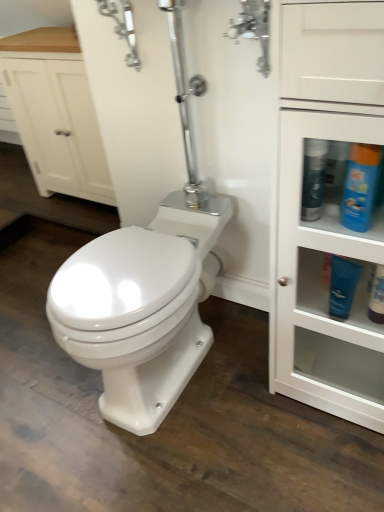
The width and height of the screenshot is (384, 512). What do you see at coordinates (377, 296) in the screenshot?
I see `matte white lotion at lower right, arranged as the second toiletry when viewed from the left` at bounding box center [377, 296].

What do you see at coordinates (55, 113) in the screenshot? The height and width of the screenshot is (512, 384). I see `white wood cabinet at upper left` at bounding box center [55, 113].

The height and width of the screenshot is (512, 384). What are the coordinates of `white wood cabinet at upper left` in the screenshot? It's located at (55, 113).

Where is `blue glossy bottle at upper right, acting as the second cleaning product starting from the right`? blue glossy bottle at upper right, acting as the second cleaning product starting from the right is located at coordinates (313, 178).

Is polished chrome faucet at upper center oriented away from white wood cabinet at upper left?

polished chrome faucet at upper center does not have its back to white wood cabinet at upper left.

Can you confirm if polished chrome faucet at upper center is positioned to the left of white wood cabinet at upper left?

No.

Can you tell me how much white glossy cabinet at right and blue glossy bottle at upper right, placed as the 2th cleaning product when sorted from left to right, differ in facing direction?

They differ by 16.2 degrees in their facing directions.

Looking at this image, is white glossy cabinet at right spatially inside blue glossy bottle at upper right, which is the 1th cleaning product from right to left, or outside of it?

white glossy cabinet at right is outside blue glossy bottle at upper right, which is the 1th cleaning product from right to left.

Is point (376, 220) more distant than point (379, 172)?

Yes, point (376, 220) is behind point (379, 172).

Could you measure the distance between white glossy cabinet at right and blue glossy bottle at upper right, placed as the 2th cleaning product when sorted from left to right?

The distance of white glossy cabinet at right from blue glossy bottle at upper right, placed as the 2th cleaning product when sorted from left to right, is 26.83 centimeters.

Can you confirm if blue glossy bottle at upper right, which is the 1th cleaning product from right to left, is thinner than blue matte lotion at right, which is counted as the 1th toiletry, starting from the left?

In fact, blue glossy bottle at upper right, which is the 1th cleaning product from right to left, might be wider than blue matte lotion at right, which is counted as the 1th toiletry, starting from the left.

How different are the orientations of blue glossy bottle at upper right, placed as the 2th cleaning product when sorted from left to right, and blue matte lotion at right, the second toiletry in the right-to-left sequence, in degrees?

16.2 degrees.

From the image's perspective, which is above, blue glossy bottle at upper right, placed as the 2th cleaning product when sorted from left to right, or blue matte lotion at right, the second toiletry in the right-to-left sequence?

blue glossy bottle at upper right, placed as the 2th cleaning product when sorted from left to right.

Is blue glossy bottle at upper right, which is the 1th cleaning product from right to left, behind blue matte lotion at right, the second toiletry in the right-to-left sequence?

No, blue glossy bottle at upper right, which is the 1th cleaning product from right to left, is closer to the camera.

Considering the positions of objects polished chrome faucet at upper center and blue glossy bottle at upper right, the first cleaning product in the left-to-right sequence, in the image provided, who is behind, polished chrome faucet at upper center or blue glossy bottle at upper right, the first cleaning product in the left-to-right sequence,?

polished chrome faucet at upper center.

Is polished chrome faucet at upper center wider than blue glossy bottle at upper right, the first cleaning product in the left-to-right sequence?

Yes.

How distant is polished chrome faucet at upper center from blue glossy bottle at upper right, acting as the second cleaning product starting from the right?

The distance of polished chrome faucet at upper center from blue glossy bottle at upper right, acting as the second cleaning product starting from the right, is 14.58 inches.

Does polished chrome faucet at upper center turn towards blue glossy bottle at upper right, acting as the second cleaning product starting from the right?

No, polished chrome faucet at upper center is not aimed at blue glossy bottle at upper right, acting as the second cleaning product starting from the right.

Is blue matte lotion at right, the second toiletry in the right-to-left sequence, next to matte white lotion at lower right, marked as the first toiletry in a right-to-left arrangement?

No, blue matte lotion at right, the second toiletry in the right-to-left sequence, is not touching matte white lotion at lower right, marked as the first toiletry in a right-to-left arrangement.

Can you tell me how much blue matte lotion at right, the second toiletry in the right-to-left sequence, and matte white lotion at lower right, marked as the first toiletry in a right-to-left arrangement, differ in facing direction?

The facing directions of blue matte lotion at right, the second toiletry in the right-to-left sequence, and matte white lotion at lower right, marked as the first toiletry in a right-to-left arrangement, are 0.00232 degrees apart.

In terms of width, does blue matte lotion at right, which is counted as the 1th toiletry, starting from the left, look wider or thinner when compared to matte white lotion at lower right, marked as the first toiletry in a right-to-left arrangement?

blue matte lotion at right, which is counted as the 1th toiletry, starting from the left, is thinner than matte white lotion at lower right, marked as the first toiletry in a right-to-left arrangement.

Looking at this image, which object is further away from the camera taking this photo, blue matte lotion at right, which is counted as the 1th toiletry, starting from the left, or matte white lotion at lower right, marked as the first toiletry in a right-to-left arrangement?

matte white lotion at lower right, marked as the first toiletry in a right-to-left arrangement, is further away from the camera.

Which is behind, point (12, 64) or point (319, 184)?

The point (12, 64) is behind.

How many degrees apart are the facing directions of white wood cabinet at upper left and blue glossy bottle at upper right, the first cleaning product in the left-to-right sequence?

The facing directions of white wood cabinet at upper left and blue glossy bottle at upper right, the first cleaning product in the left-to-right sequence, are 0.531 degrees apart.

Based on their sizes in the image, would you say white wood cabinet at upper left is bigger or smaller than blue glossy bottle at upper right, the first cleaning product in the left-to-right sequence?

white wood cabinet at upper left is bigger than blue glossy bottle at upper right, the first cleaning product in the left-to-right sequence.

From a real-world perspective, which object stands above the other?

In real-world perspective, blue glossy bottle at upper right, placed as the 2th cleaning product when sorted from left to right, is above.

Which of these two, blue glossy bottle at upper right, acting as the second cleaning product starting from the right, or blue glossy bottle at upper right, which is the 1th cleaning product from right to left, is smaller?

Smaller between the two is blue glossy bottle at upper right, acting as the second cleaning product starting from the right.

Does blue glossy bottle at upper right, acting as the second cleaning product starting from the right, contain blue glossy bottle at upper right, placed as the 2th cleaning product when sorted from left to right?

No, blue glossy bottle at upper right, placed as the 2th cleaning product when sorted from left to right, is not a part of blue glossy bottle at upper right, acting as the second cleaning product starting from the right.

Identify the location of cleaning product below the blue glossy bottle at upper right, acting as the second cleaning product starting from the right (from the image's perspective). (360, 186).

In the image, there is a polished chrome faucet at upper center. Identify the location of bathroom cabinet above it (from the image's perspective). (55, 113).

Find the location of a particular element. the 1st cleaning product behind the white glossy cabinet at right, starting your count from the anchor is located at coordinates (360, 186).

Estimate the real-world distances between objects in this image. Which object is closer to blue glossy bottle at upper right, placed as the 2th cleaning product when sorted from left to right, white wood cabinet at upper left or blue matte lotion at right, which is counted as the 1th toiletry, starting from the left?

Among the two, blue matte lotion at right, which is counted as the 1th toiletry, starting from the left, is located nearer to blue glossy bottle at upper right, placed as the 2th cleaning product when sorted from left to right.

Estimate the real-world distances between objects in this image. Which object is further from blue glossy bottle at upper right, placed as the 2th cleaning product when sorted from left to right, matte white lotion at lower right, arranged as the second toiletry when viewed from the left, or white wood cabinet at upper left?

The object further to blue glossy bottle at upper right, placed as the 2th cleaning product when sorted from left to right, is white wood cabinet at upper left.

Looking at the image, which one is located closer to polished chrome faucet at upper center, white glossy cabinet at right or blue glossy bottle at upper right, the first cleaning product in the left-to-right sequence?

blue glossy bottle at upper right, the first cleaning product in the left-to-right sequence, is closer to polished chrome faucet at upper center.

When comparing their distances from matte white lotion at lower right, arranged as the second toiletry when viewed from the left, does white wood cabinet at upper left or blue matte lotion at right, which is counted as the 1th toiletry, starting from the left, seem further?

white wood cabinet at upper left is positioned further to the anchor matte white lotion at lower right, arranged as the second toiletry when viewed from the left.

Which object lies nearer to the anchor point blue matte lotion at right, the second toiletry in the right-to-left sequence, blue glossy bottle at upper right, the first cleaning product in the left-to-right sequence, or white wood cabinet at upper left?

blue glossy bottle at upper right, the first cleaning product in the left-to-right sequence, is positioned closer to the anchor blue matte lotion at right, the second toiletry in the right-to-left sequence.

Which object lies nearer to the anchor point white wood cabinet at upper left, blue glossy bottle at upper right, which is the 1th cleaning product from right to left, or blue glossy bottle at upper right, acting as the second cleaning product starting from the right?

blue glossy bottle at upper right, acting as the second cleaning product starting from the right, is positioned closer to the anchor white wood cabinet at upper left.

When comparing their distances from white glossy cabinet at right, does matte white lotion at lower right, marked as the first toiletry in a right-to-left arrangement, or white wood cabinet at upper left seem further?

white wood cabinet at upper left is further to white glossy cabinet at right.

In the scene shown: When comparing their distances from white wood cabinet at upper left, does matte white lotion at lower right, arranged as the second toiletry when viewed from the left, or blue glossy bottle at upper right, acting as the second cleaning product starting from the right, seem closer?

blue glossy bottle at upper right, acting as the second cleaning product starting from the right, is positioned closer to the anchor white wood cabinet at upper left.

Image resolution: width=384 pixels, height=512 pixels. I want to click on toiletry located between white glossy cabinet at right and matte white lotion at lower right, marked as the first toiletry in a right-to-left arrangement, in the depth direction, so click(x=342, y=285).

This screenshot has height=512, width=384. I want to click on cabinetry between polished chrome faucet at upper center and matte white lotion at lower right, marked as the first toiletry in a right-to-left arrangement, from top to bottom, so (x=322, y=282).

This screenshot has width=384, height=512. In order to click on toiletry between blue glossy bottle at upper right, the first cleaning product in the left-to-right sequence, and matte white lotion at lower right, marked as the first toiletry in a right-to-left arrangement, from top to bottom in this screenshot , I will do `click(342, 285)`.

Image resolution: width=384 pixels, height=512 pixels. What are the coordinates of `cleaning product between blue glossy bottle at upper right, the first cleaning product in the left-to-right sequence, and matte white lotion at lower right, marked as the first toiletry in a right-to-left arrangement, in the vertical direction` in the screenshot? It's located at (360, 186).